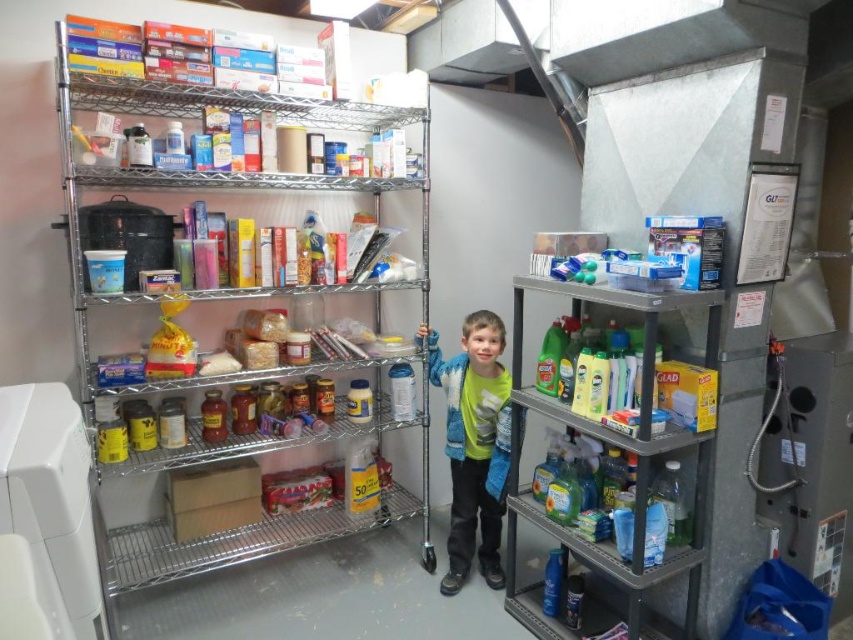
Question: Does blue fleece jacket at center appear on the left side of metallic silver shelves at upper left?

Choices:
 (A) no
 (B) yes

Answer: (A)

Question: Is the position of gray plastic shelf at right more distant than that of metallic silver shelves at upper left?

Choices:
 (A) no
 (B) yes

Answer: (A)

Question: Considering the real-world distances, which object is closest to the gray plastic shelf at right?

Choices:
 (A) metallic silver shelves at left
 (B) blue fleece jacket at center
 (C) metallic silver shelves at upper left

Answer: (B)

Question: Can you confirm if blue fleece jacket at center is positioned to the left of metallic silver shelves at upper left?

Choices:
 (A) no
 (B) yes

Answer: (A)

Question: Which of the following is the closest to the observer?

Choices:
 (A) (164, 576)
 (B) (460, 573)
 (C) (213, 243)

Answer: (C)

Question: Which object is the closest to the blue fleece jacket at center?

Choices:
 (A) metallic silver shelves at left
 (B) gray plastic shelf at right
 (C) metallic silver shelves at upper left

Answer: (B)